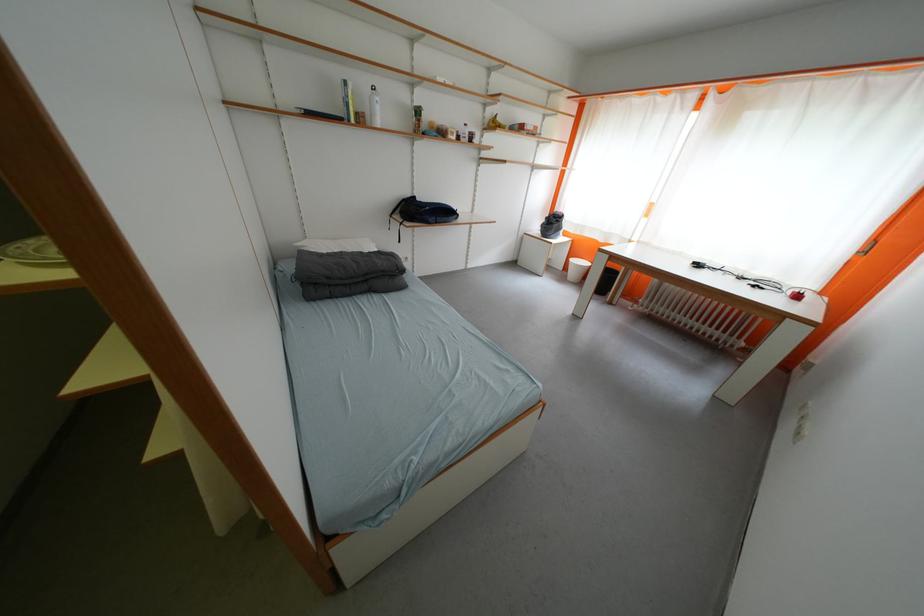
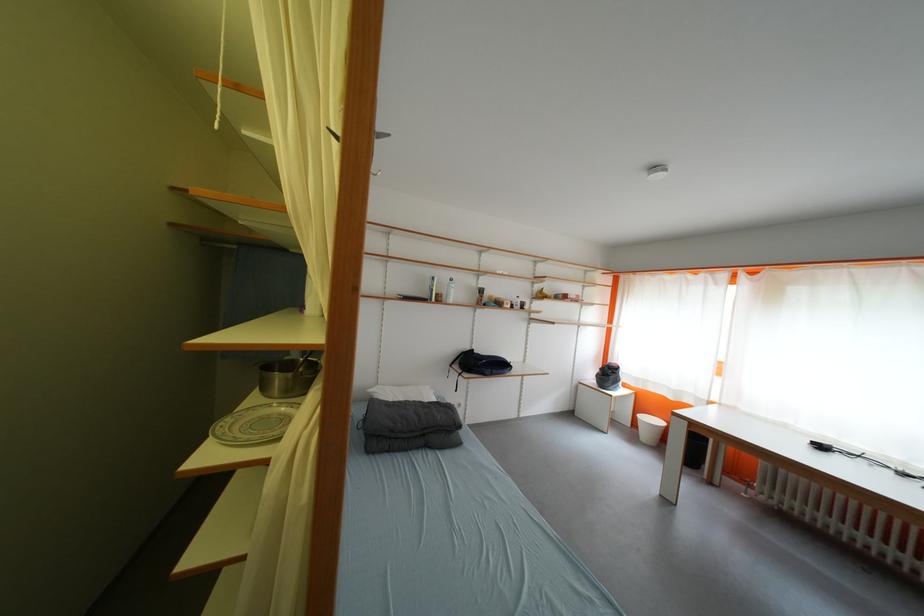
Where in the second image is the point corresponding to point (406, 220) from the first image?

(466, 370)